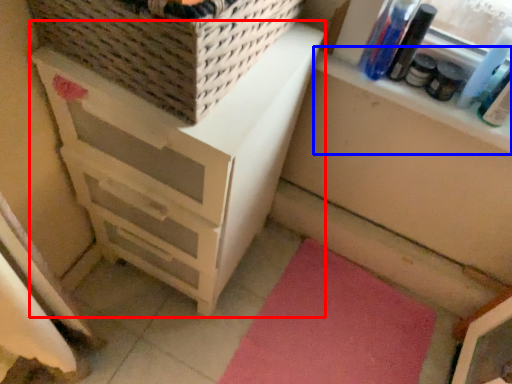
Question: Which object appears closest to the camera in this image, chest of drawers (highlighted by a red box) or window sill (highlighted by a blue box)?

Choices:
 (A) chest of drawers
 (B) window sill

Answer: (A)